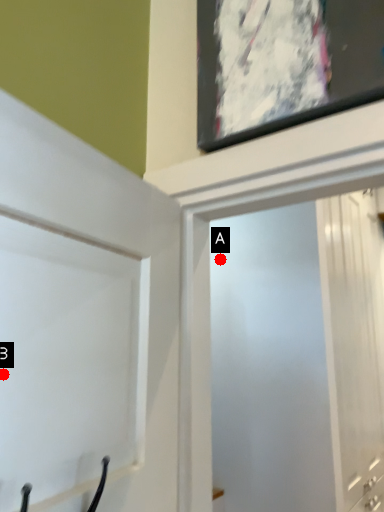
Question: Two points are circled on the image, labeled by A and B beside each circle. Which of the following is the farthest from the observer?

Choices:
 (A) A is further
 (B) B is further

Answer: (A)